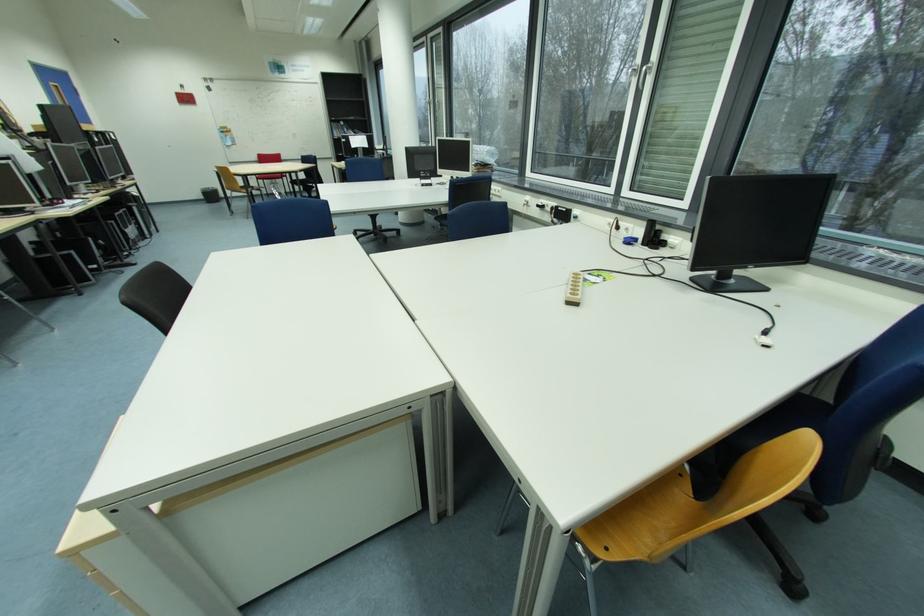
Where would you pull the window handle? Please return your answer as a coordinate pair (x, y).

(643, 75)